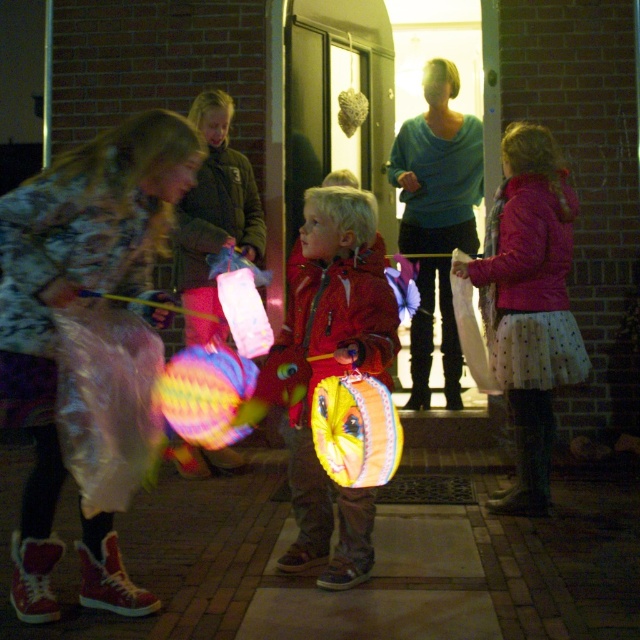
Question: Which object is closer to the camera taking this photo?

Choices:
 (A) shiny red jacket at center
 (B) polka dot skirt at center

Answer: (A)

Question: Is the position of shiny red jacket at center less distant than that of polka dot skirt at center?

Choices:
 (A) yes
 (B) no

Answer: (A)

Question: Does shiny red jacket at center appear on the left side of polka dot skirt at center?

Choices:
 (A) no
 (B) yes

Answer: (B)

Question: Among these objects, which one is farthest from the camera?

Choices:
 (A) polka dot skirt at center
 (B) shiny red jacket at center

Answer: (A)

Question: Among these objects, which one is nearest to the camera?

Choices:
 (A) shiny red jacket at center
 (B) polka dot skirt at center

Answer: (A)

Question: Is shiny red jacket at center bigger than polka dot skirt at center?

Choices:
 (A) no
 (B) yes

Answer: (B)